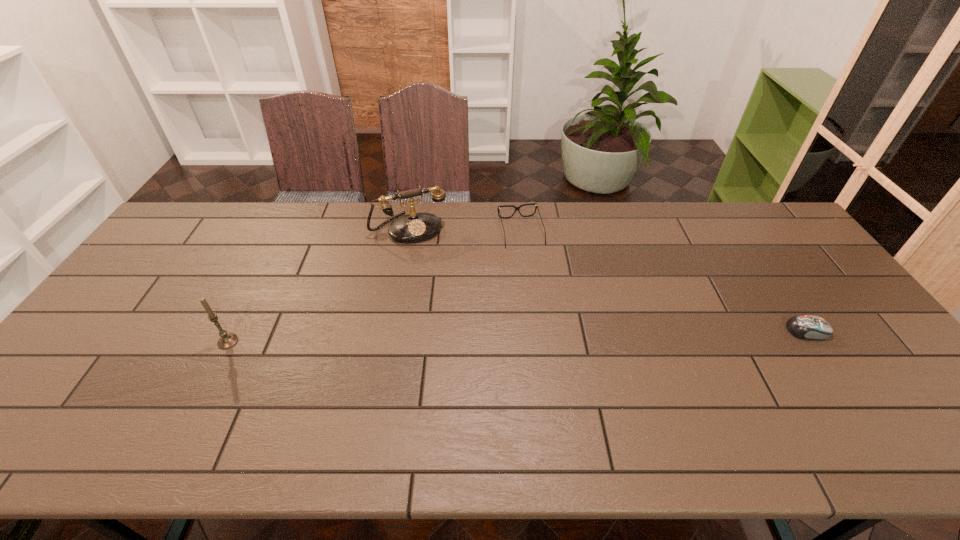
At what (x,y) coordinates should I click in order to perform the action: click on free spot between the leftmost object and the second shortest object. Please return your answer as a coordinate pair (x, y). Looking at the image, I should click on (374, 287).

The width and height of the screenshot is (960, 540). I want to click on vacant space that is in between the rightmost object and the second object from left to right, so click(x=609, y=280).

Identify the location of vacant area that lies between the third object from right to left and the shortest object. 609,280.

Choose which object is the second nearest neighbor to the computer mouse. Please provide its 2D coordinates. Your answer should be formatted as a tuple, i.e. [(x, y)], where the tuple contains the x and y coordinates of a point satisfying the conditions above.

[(415, 227)]

Locate which object is the second closest to the third object from left to right. Please provide its 2D coordinates. Your answer should be formatted as a tuple, i.e. [(x, y)], where the tuple contains the x and y coordinates of a point satisfying the conditions above.

[(812, 327)]

At what (x,y) coordinates should I click in order to perform the action: click on free space that satisfies the following two spatial constraints: 1. on the front side of the second object from left to right; 2. on the wheel side of the rightmost object. Please return your answer as a coordinate pair (x, y). Image resolution: width=960 pixels, height=540 pixels. Looking at the image, I should click on (391, 330).

Find the location of a particular element. Image resolution: width=960 pixels, height=540 pixels. free point that satisfies the following two spatial constraints: 1. on the front side of the spectacles; 2. on the wheel side of the shortest object is located at coordinates (531, 330).

You are a GUI agent. You are given a task and a screenshot of the screen. Output one action in this format:
    pyautogui.click(x=<x>, y=<y>)
    Task: Click on the blank area in the image that satisfies the following two spatial constraints: 1. on the front side of the third tallest object; 2. on the right side of the telephone
    
    Given the screenshot: What is the action you would take?
    pyautogui.click(x=409, y=232)